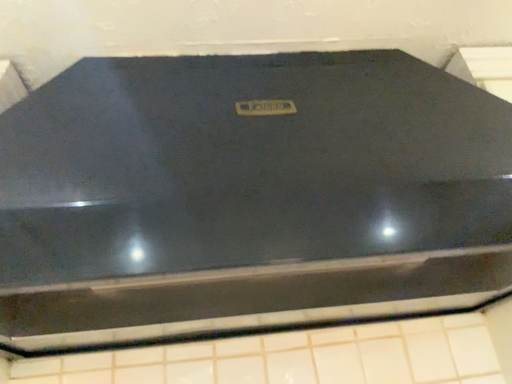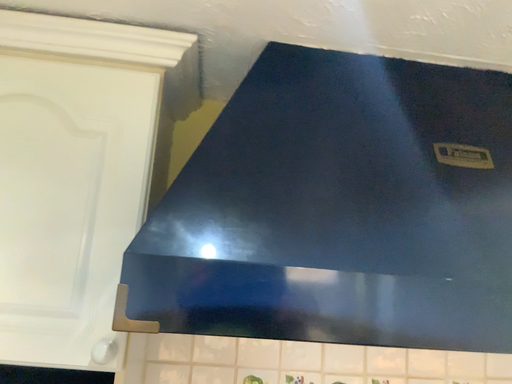
Question: Which way did the camera rotate in the video?

Choices:
 (A) rotated upward
 (B) rotated downward

Answer: (B)